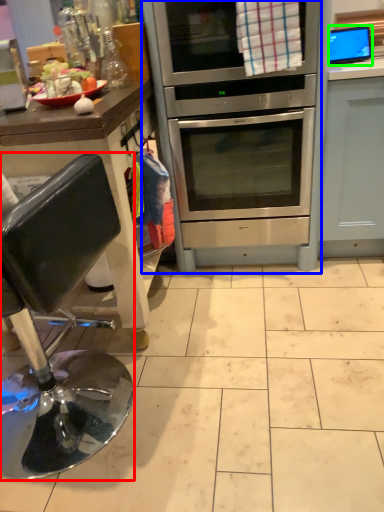
Question: Estimate the real-world distances between objects in this image. Which object is farther from chair (highlighted by a red box), oven (highlighted by a blue box) or appliance (highlighted by a green box)?

Choices:
 (A) oven
 (B) appliance

Answer: (B)